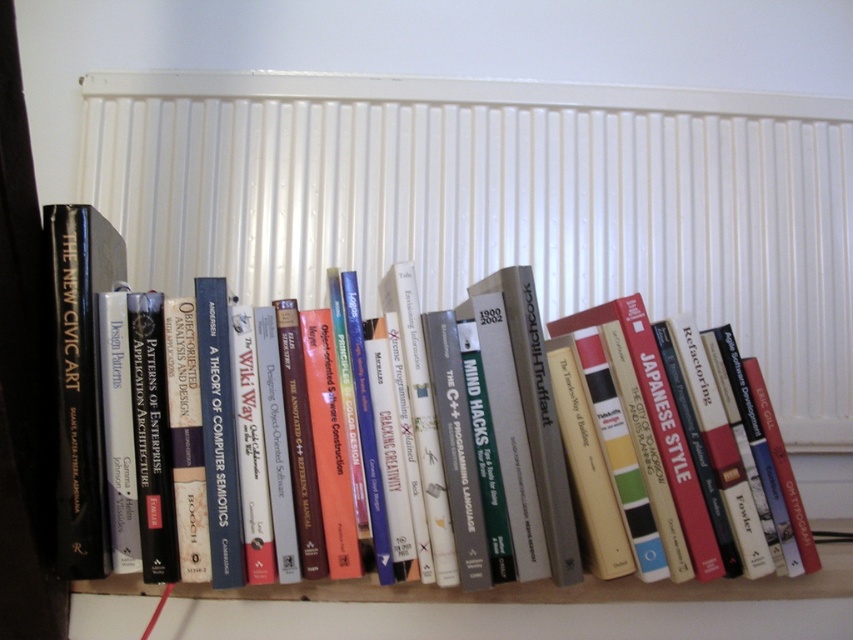
Is white textured radiator at upper center to the right of hardcover book at center from the viewer's perspective?

A: Yes, white textured radiator at upper center is to the right of hardcover book at center.

Where is `white textured radiator at upper center`? white textured radiator at upper center is located at coordinates (498, 202).

Is point (613, 586) less distant than point (96, 360)?

No, (613, 586) is further to viewer.

From the picture: Does hardcover book at center have a greater width compared to black hardcover book at left?

Correct, the width of hardcover book at center exceeds that of black hardcover book at left.

Measure the distance between hardcover book at center and camera.

hardcover book at center and camera are 26.78 inches apart from each other.

The height and width of the screenshot is (640, 853). Find the location of `hardcover book at center`. hardcover book at center is located at coordinates (590, 481).

Does white textured radiator at upper center appear under black hardcover book at left?

No, white textured radiator at upper center is not below black hardcover book at left.

The width and height of the screenshot is (853, 640). Identify the location of white textured radiator at upper center. (498, 202).